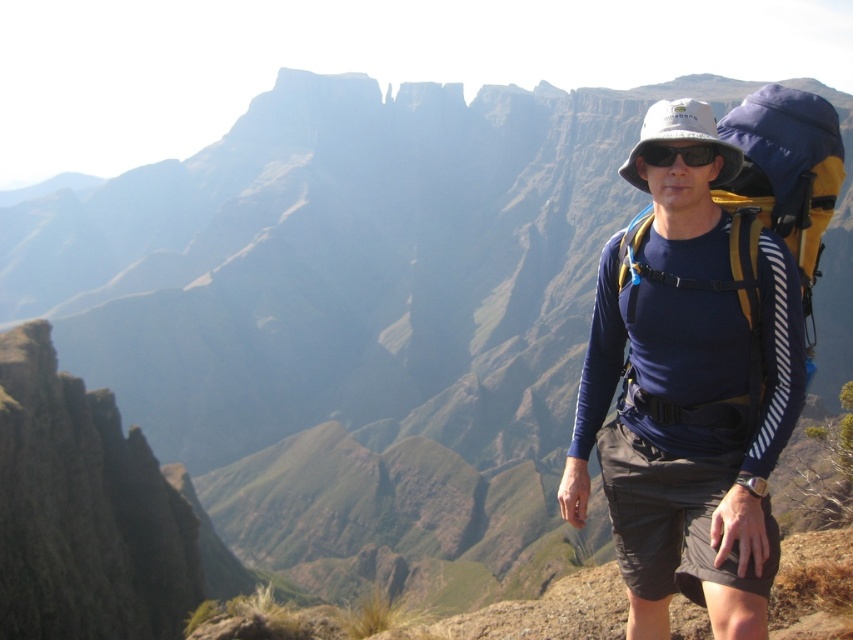
Question: Which of the following is the closest to the observer?

Choices:
 (A) (643, 152)
 (B) (755, 186)
 (C) (755, 392)

Answer: (C)

Question: Can you confirm if blue fabric shirt at center is wider than blue/yellow fabric backpack at right?

Choices:
 (A) no
 (B) yes

Answer: (A)

Question: Which point appears farthest from the camera in this image?

Choices:
 (A) (781, 353)
 (B) (784, 228)

Answer: (B)

Question: Is blue fabric shirt at center to the right of black matte sunglasses at center from the viewer's perspective?

Choices:
 (A) yes
 (B) no

Answer: (A)

Question: Considering the real-world distances, which object is closest to the black matte sunglasses at center?

Choices:
 (A) blue/yellow fabric backpack at right
 (B) blue fabric shirt at center

Answer: (A)

Question: Is blue fabric shirt at center closer to camera compared to black matte sunglasses at center?

Choices:
 (A) yes
 (B) no

Answer: (A)